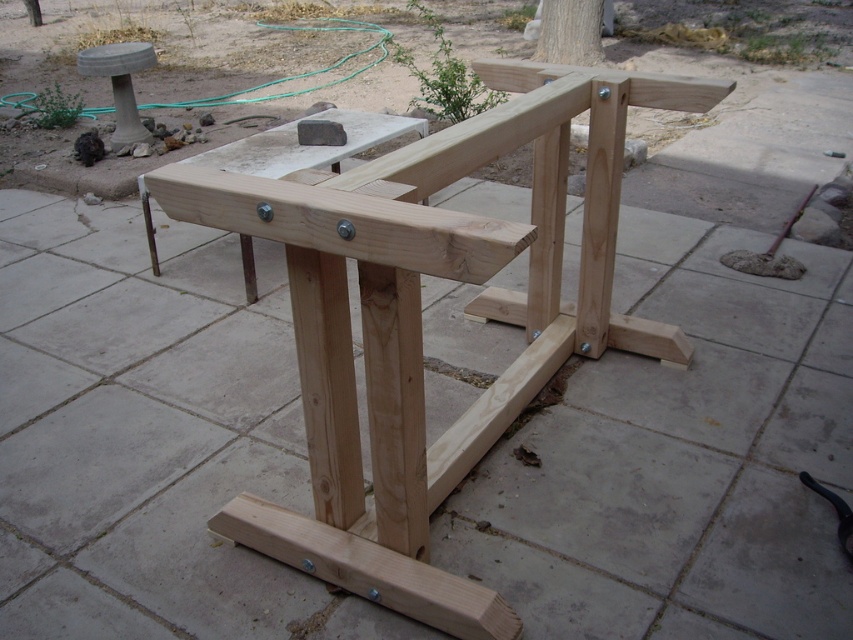
Question: Does natural wood frame at center have a smaller size compared to smooth concrete stool at upper left?

Choices:
 (A) no
 (B) yes

Answer: (A)

Question: Which of the following is the closest to the observer?

Choices:
 (A) (666, 88)
 (B) (117, 76)

Answer: (A)

Question: Which of the following is the closest to the observer?

Choices:
 (A) (479, 156)
 (B) (144, 61)

Answer: (A)

Question: Does natural wood frame at center appear over smooth concrete stool at upper left?

Choices:
 (A) yes
 (B) no

Answer: (B)

Question: Is natural wood frame at center to the left of smooth concrete stool at upper left from the viewer's perspective?

Choices:
 (A) no
 (B) yes

Answer: (A)